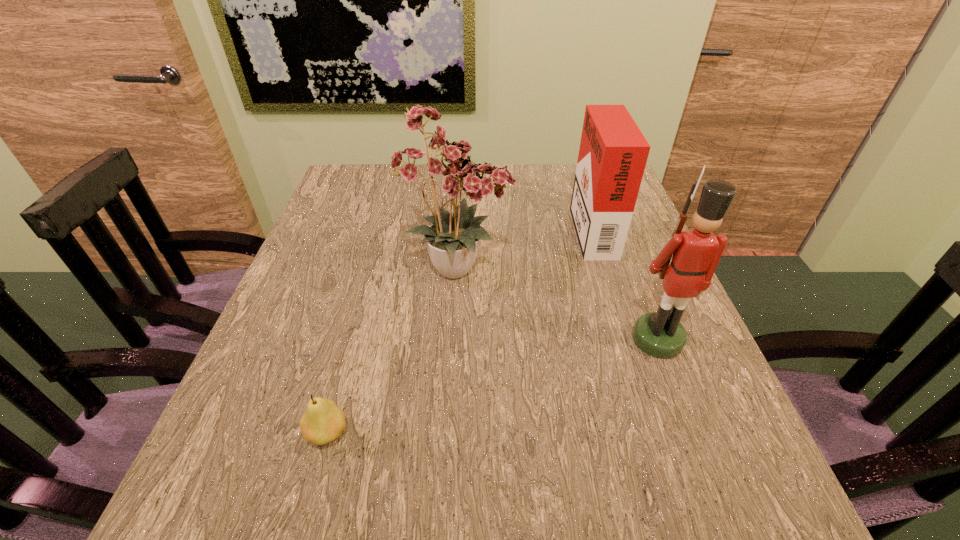
This screenshot has height=540, width=960. I want to click on the second object from left to right, so click(448, 170).

You are a GUI agent. You are given a task and a screenshot of the screen. Output one action in this format:
    pyautogui.click(x=<x>, y=<y>)
    Task: Click on the nutcracker
    
    Given the screenshot: What is the action you would take?
    pyautogui.click(x=696, y=253)

This screenshot has height=540, width=960. Identify the location of the third tallest object. (613, 152).

Locate an element on the screen. pear is located at coordinates (324, 421).

Locate an element on the screen. This screenshot has width=960, height=540. the leftmost object is located at coordinates (324, 421).

Image resolution: width=960 pixels, height=540 pixels. What are the coordinates of `vacant area situated 0.240m on the front-facing side of the flower arrangement` in the screenshot? It's located at (624, 268).

The image size is (960, 540). I want to click on vacant point located 0.140m on the front-facing side of the third farthest object, so tap(693, 430).

I want to click on free space located on the front-facing side of the cigarette case, so click(x=479, y=227).

At what (x,y) coordinates should I click in order to perform the action: click on blank space located on the front-facing side of the cigarette case. Please return your answer as a coordinate pair (x, y). Looking at the image, I should click on (551, 227).

The image size is (960, 540). In order to click on vacant space located 0.180m on the front-facing side of the cigarette case in this screenshot , I will do `click(503, 227)`.